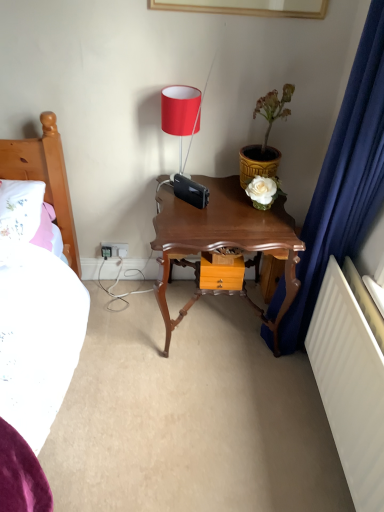
Identify the location of free point to the left of yellow textured pot at upper right. Image resolution: width=384 pixels, height=512 pixels. (216, 186).